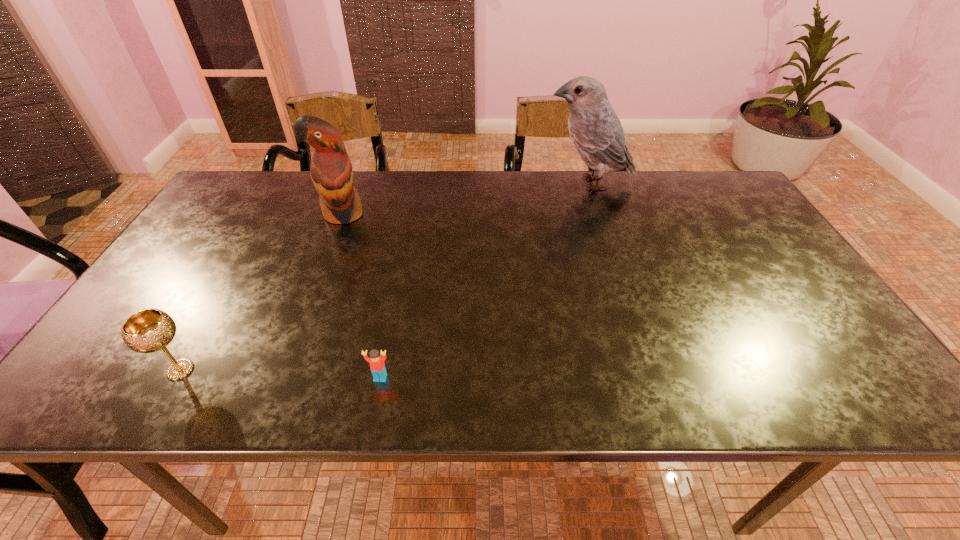
The width and height of the screenshot is (960, 540). Find the location of `free region located 0.340m on the front-facing side of the farthest object`. free region located 0.340m on the front-facing side of the farthest object is located at coordinates (437, 183).

The width and height of the screenshot is (960, 540). In order to click on vacant space located 0.120m on the face of the nearer parrot in this screenshot , I will do `click(326, 258)`.

The image size is (960, 540). What are the coordinates of `blank space located 0.180m on the right of the leftmost object` in the screenshot? It's located at (288, 370).

I want to click on chalice at the near edge, so click(x=149, y=330).

Identify the location of Lego that is at the near edge. tap(377, 366).

You are a GUI agent. You are given a task and a screenshot of the screen. Output one action in this format:
    pyautogui.click(x=<x>, y=<y>)
    Task: Click on the object positioned at the left edge
    This screenshot has height=540, width=960.
    Given the screenshot: What is the action you would take?
    pyautogui.click(x=149, y=330)

Locate an element on the screen. This screenshot has width=960, height=540. object that is at the near left corner is located at coordinates (149, 330).

Locate an element on the screen. The image size is (960, 540). free location at the far edge is located at coordinates (503, 201).

You are a GUI agent. You are given a task and a screenshot of the screen. Output one action in this format:
    pyautogui.click(x=<x>, y=<y>)
    Task: Click on the vacant space at the near edge of the desktop
    The image size is (960, 540).
    Given the screenshot: What is the action you would take?
    pyautogui.click(x=646, y=394)

Locate an element on the screen. The height and width of the screenshot is (540, 960). free space at the left edge is located at coordinates (194, 239).